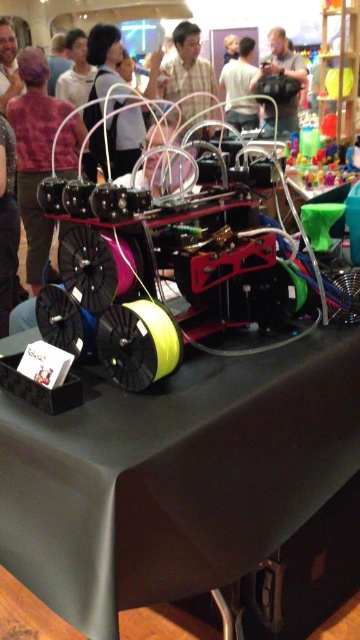
From the picture: You are attending a tech exhibition and notice the black matte table at center and the white matte shirt at upper center in the scene. Which object is shorter in height?

The black matte table at center has a lesser height compared to the white matte shirt at upper center, so the black matte table at center is shorter in height.